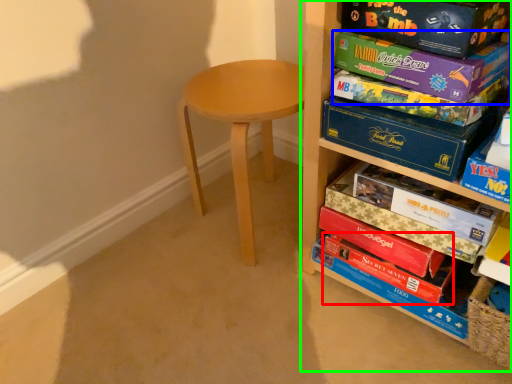
Question: Which object is positioned farthest from paperback book (highlighted by a red box)? Select from paperback book (highlighted by a blue box) and shelf (highlighted by a green box).

Choices:
 (A) paperback book
 (B) shelf

Answer: (A)